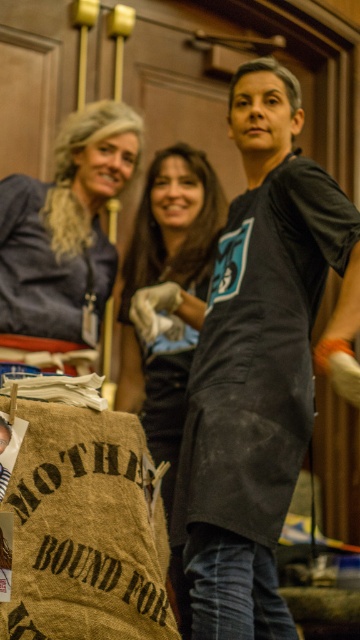
You are standing in the room and want to know the exact location of the matte blue shirt at left. Can you tell me its coordinates?

The matte blue shirt at left is located at coordinates point (65,230).

You are a guest at this event and want to determine which item is shorter between the black matte apron at center and the black matte shirt at center. Which one is shorter?

The black matte apron at center has a lesser height compared to the black matte shirt at center, so the apron is shorter.

Consider the image. You are standing in the room and want to reach the point marked as point (340,312). Can you walk directly to it without moving around any obstacles?

The distance between you and point (340,312) is 1.69 meters, so yes, you can walk directly to it without needing to move around any obstacles as there is no mention of obstacles in the scene description.